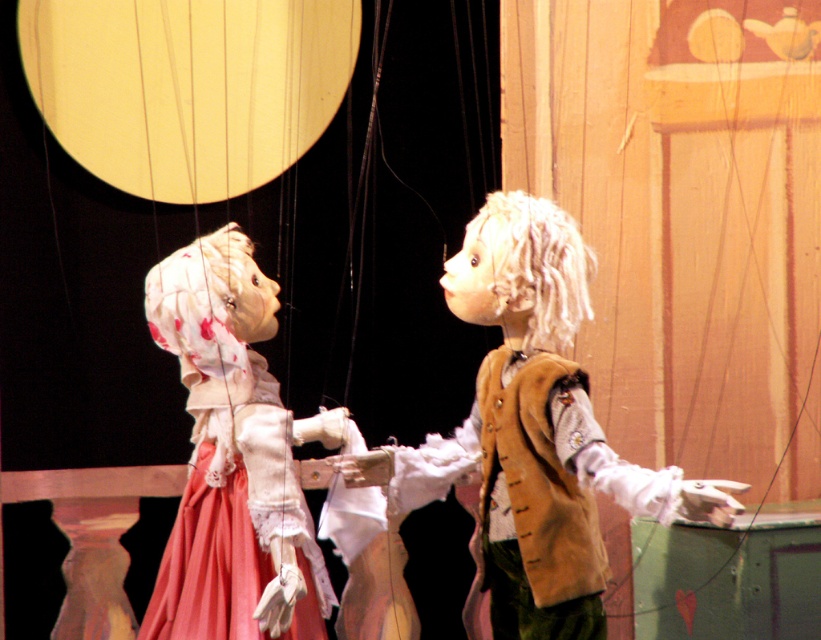
Question: Which object is the farthest from the velvet brown vest at center?

Choices:
 (A) matte white doll at left
 (B) brown suede vest at center

Answer: (A)

Question: Estimate the real-world distances between objects in this image. Which object is closer to the velvet brown vest at center?

Choices:
 (A) brown suede vest at center
 (B) matte white doll at left

Answer: (A)

Question: Is velvet brown vest at center to the right of matte white doll at left from the viewer's perspective?

Choices:
 (A) no
 (B) yes

Answer: (B)

Question: Is velvet brown vest at center thinner than matte white doll at left?

Choices:
 (A) yes
 (B) no

Answer: (B)

Question: Can you confirm if velvet brown vest at center is bigger than matte white doll at left?

Choices:
 (A) no
 (B) yes

Answer: (B)

Question: Among these points, which one is nearest to the camera?

Choices:
 (A) (212, 460)
 (B) (402, 497)

Answer: (A)